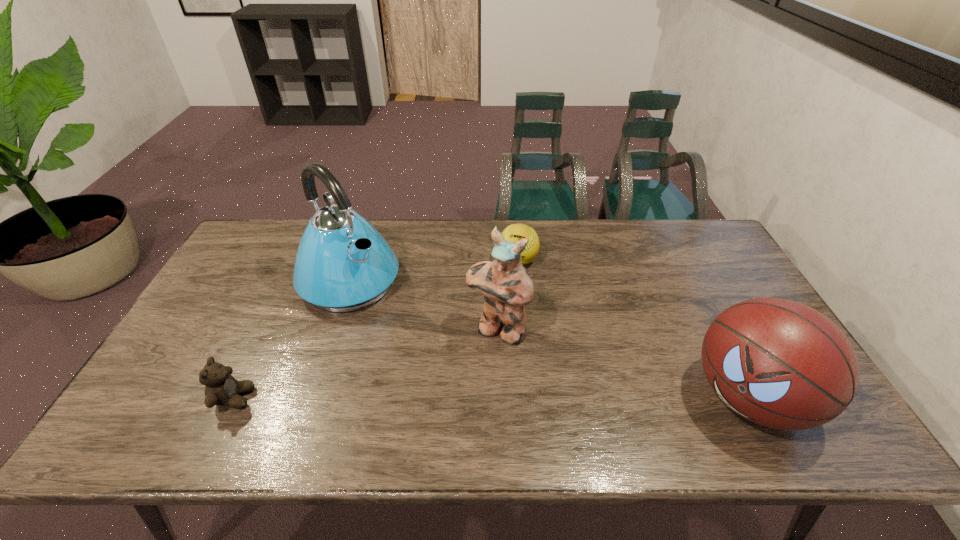
The height and width of the screenshot is (540, 960). In order to click on free space on the desktop that is between the teddy bear and the basketball and is positioned on the logo side of the softball in this screenshot , I will do `click(469, 398)`.

Locate an element on the screen. This screenshot has width=960, height=540. free space on the desktop that is between the teddy bear and the basketball and is positioned on the front-facing side of the figurine is located at coordinates (458, 398).

The height and width of the screenshot is (540, 960). I want to click on free space on the desktop that is between the teddy bear and the basketball and is positioned at the spout of the kettle, so click(x=484, y=398).